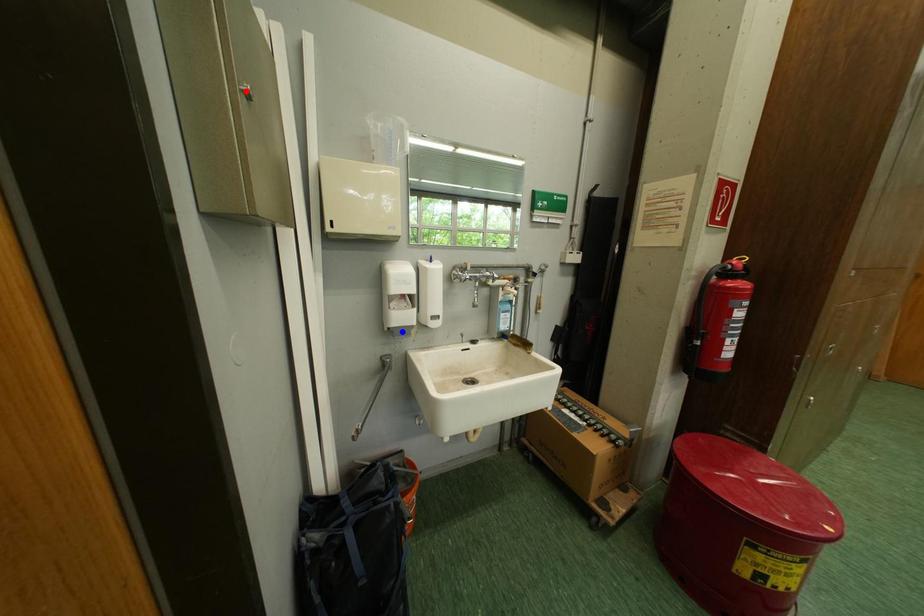
Question: Two points are marked on the image. Which point is closer to the camera?

Choices:
 (A) Blue point is closer.
 (B) Red point is closer.

Answer: (B)